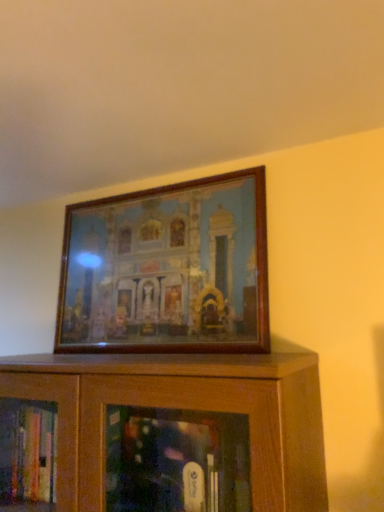
The height and width of the screenshot is (512, 384). Describe the element at coordinates (168, 270) in the screenshot. I see `wooden picture frame at upper center` at that location.

Find the location of a particular element. wooden picture frame at upper center is located at coordinates (168, 270).

Find the location of `wooden picture frame at upper center`. wooden picture frame at upper center is located at coordinates (168, 270).